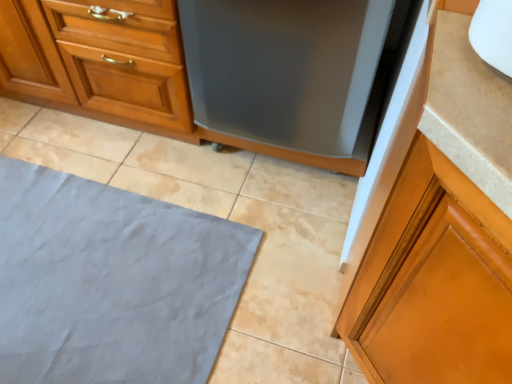
Locate an element on the screen. This screenshot has width=512, height=384. free spot below gray fabric bath mat at lower left (from a real-world perspective) is located at coordinates (104, 287).